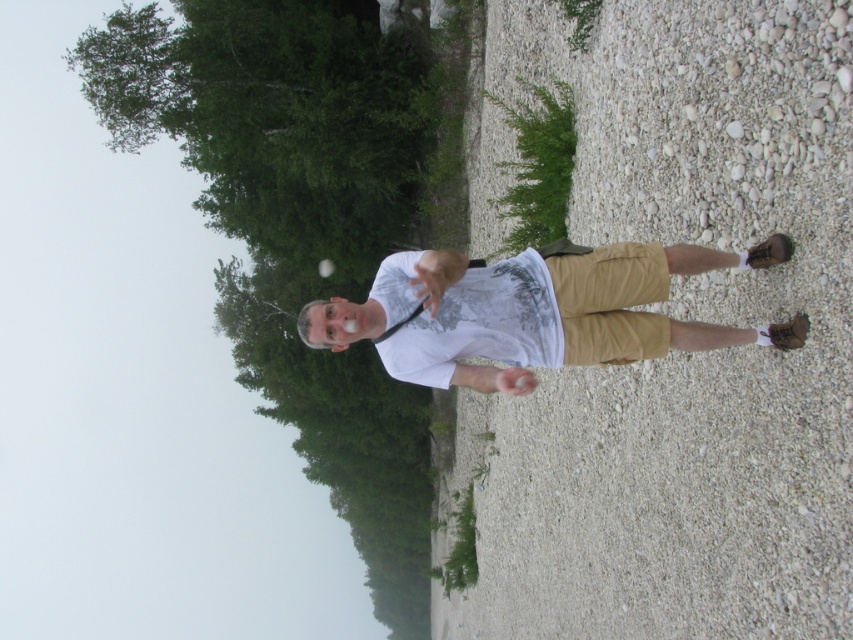
Is white gravel at center thinner than white matte shirt at center?

Yes, white gravel at center is thinner than white matte shirt at center.

Between white gravel at center and white matte shirt at center, which one appears on the left side from the viewer's perspective?

From the viewer's perspective, white matte shirt at center appears more on the left side.

Which is in front, point (579, 480) or point (534, 387)?

Point (534, 387)

Image resolution: width=853 pixels, height=640 pixels. I want to click on white gravel at center, so click(x=677, y=317).